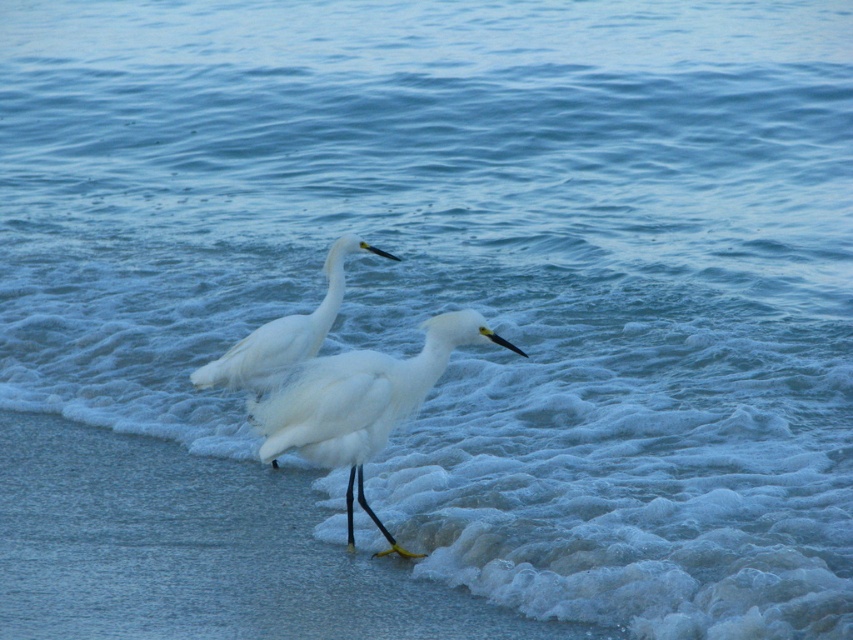
Question: Which point appears closest to the camera in this image?

Choices:
 (A) (271, 368)
 (B) (492, 342)

Answer: (B)

Question: Which point appears closest to the camera in this image?

Choices:
 (A) (267, 333)
 (B) (364, 368)

Answer: (B)

Question: Is white fluffy bird at center above white feathered bird at center?

Choices:
 (A) no
 (B) yes

Answer: (A)

Question: Is white fluffy bird at center further to the viewer compared to white feathered bird at center?

Choices:
 (A) yes
 (B) no

Answer: (B)

Question: Can you confirm if white fluffy bird at center is thinner than white feathered bird at center?

Choices:
 (A) no
 (B) yes

Answer: (A)